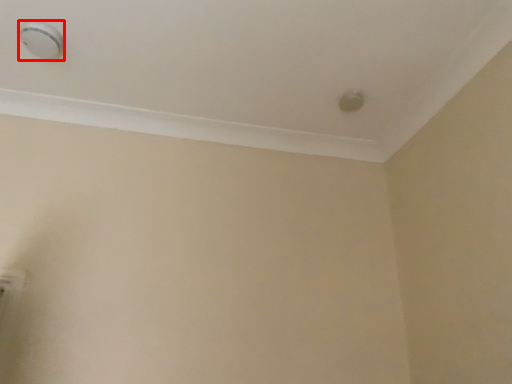
Question: From the image's perspective, where is knob (annotated by the red box) located relative to knob?

Choices:
 (A) above
 (B) below

Answer: (A)